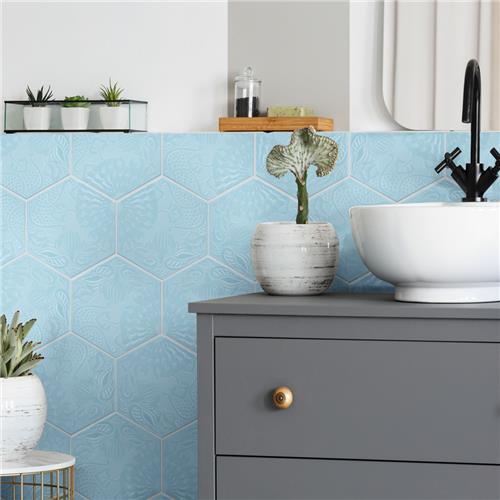
This screenshot has width=500, height=500. I want to click on table, so click(x=33, y=466).